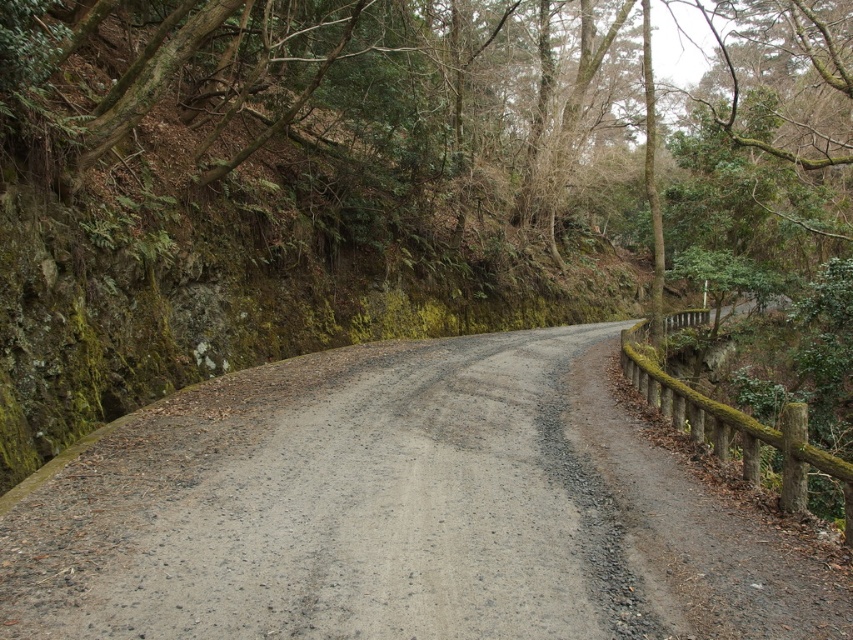
Question: Which object appears closest to the camera in this image?

Choices:
 (A) gray gravel road at center
 (B) green mossy rock at upper left

Answer: (A)

Question: Does green mossy rock at upper left have a larger size compared to gray gravel road at center?

Choices:
 (A) yes
 (B) no

Answer: (A)

Question: Can you confirm if green mossy rock at upper left is wider than gray gravel road at center?

Choices:
 (A) yes
 (B) no

Answer: (A)

Question: Which point is farther to the camera?

Choices:
 (A) (473, 227)
 (B) (126, 458)

Answer: (A)

Question: Which point is closer to the camera?

Choices:
 (A) (476, 346)
 (B) (624, 42)

Answer: (A)

Question: Can you confirm if green mossy rock at upper left is positioned to the right of gray gravel road at center?

Choices:
 (A) yes
 (B) no

Answer: (A)